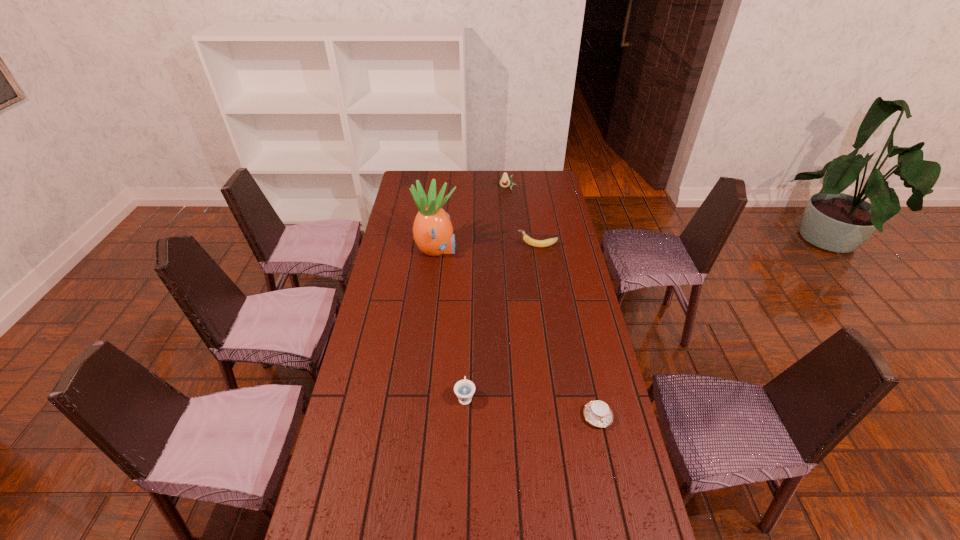
Where is `vacant space that is in between the shorter teacup and the pineapple`? Image resolution: width=960 pixels, height=540 pixels. vacant space that is in between the shorter teacup and the pineapple is located at coordinates [x=517, y=333].

Identify the location of vacant point located between the right teacup and the leftmost object. This screenshot has width=960, height=540. (517, 333).

The image size is (960, 540). What are the coordinates of `empty location between the pineapple and the banana` in the screenshot? It's located at [x=487, y=248].

Find the location of a particular element. This screenshot has height=540, width=960. vacant space that's between the leftmost object and the banana is located at coordinates (487, 248).

Where is `vacant point located between the leftmost object and the right teacup`? vacant point located between the leftmost object and the right teacup is located at coordinates (517, 333).

This screenshot has width=960, height=540. In order to click on object that is the third nearest to the taller teacup in this screenshot , I will do `click(536, 243)`.

Locate an element on the screen. This screenshot has height=540, width=960. object that is the closest to the left teacup is located at coordinates (597, 413).

This screenshot has height=540, width=960. Find the location of `vacant space that satisfies the following two spatial constraints: 1. at the entrance of the tallest object; 2. on the side of the taller teacup with the handle`. vacant space that satisfies the following two spatial constraints: 1. at the entrance of the tallest object; 2. on the side of the taller teacup with the handle is located at coordinates (420, 396).

This screenshot has width=960, height=540. Identify the location of free point that satisfies the following two spatial constraints: 1. on the seed side of the avocado; 2. at the entrance of the tallest object. (514, 250).

You are a GUI agent. You are given a task and a screenshot of the screen. Output one action in this format:
    pyautogui.click(x=<x>, y=<y>)
    Task: Click on the vacant region that satisfies the following two spatial constraints: 1. at the entrance of the pineapple; 2. on the side of the taller teacup with the handle
    The image size is (960, 540).
    Given the screenshot: What is the action you would take?
    pyautogui.click(x=420, y=396)